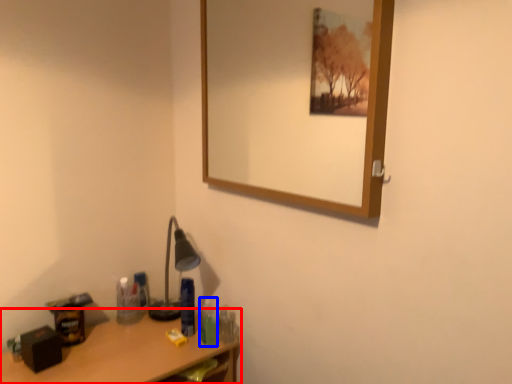
Question: Among these objects, which one is farthest to the camera, desk (highlighted by a red box) or toiletry (highlighted by a blue box)?

Choices:
 (A) desk
 (B) toiletry

Answer: (B)